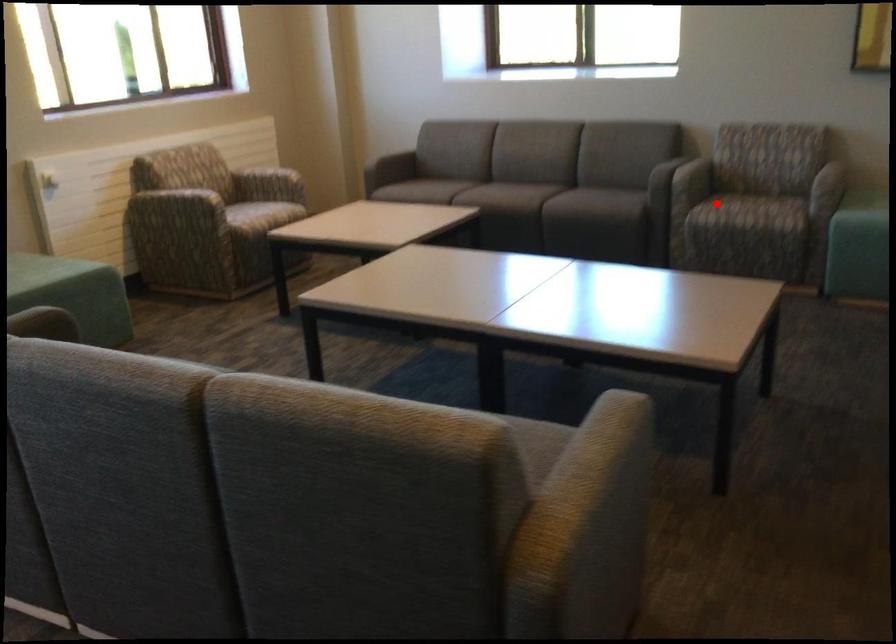
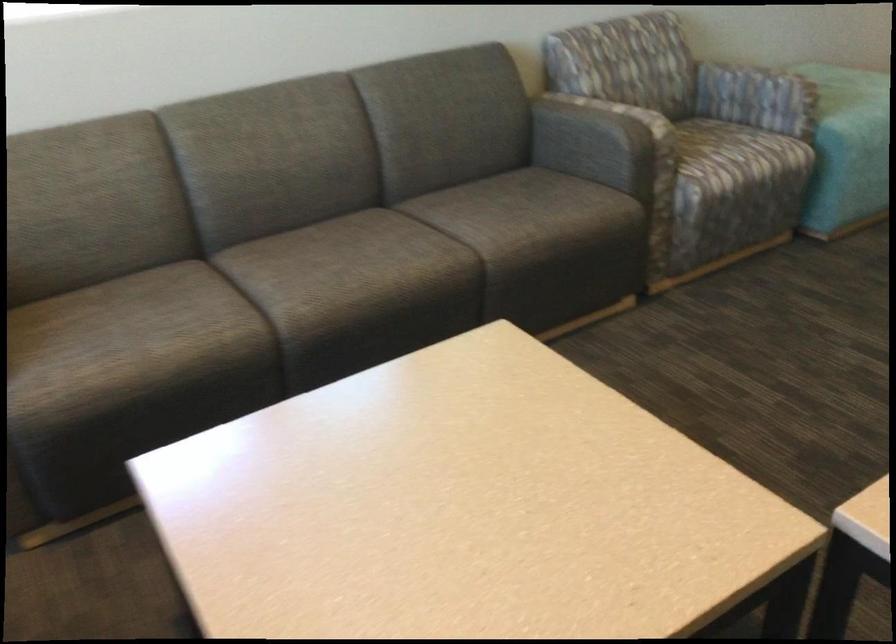
Question: I am providing you with two images of the same scene from different viewpoints. Image1 has a red point marked. In image2, the corresponding 3D location appears at what relative position? Reply with the corresponding letter.

Choices:
 (A) Closer
 (B) Farther

Answer: (A)